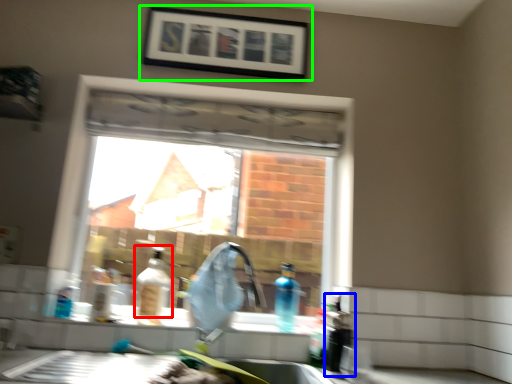
Question: Estimate the real-world distances between objects in this image. Which object is farther from bottle (highlighted by a red box), bottle (highlighted by a blue box) or picture frame (highlighted by a green box)?

Choices:
 (A) bottle
 (B) picture frame

Answer: (B)